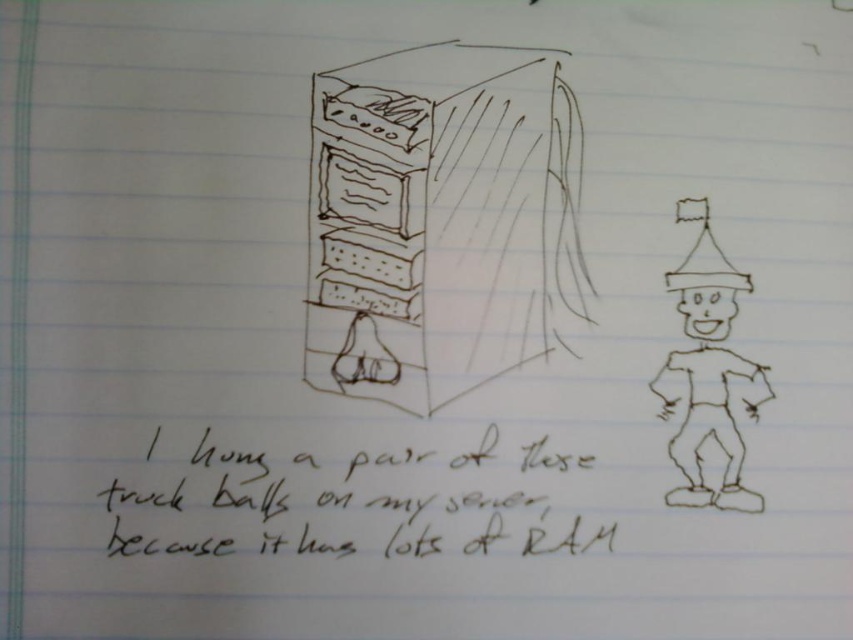
Question: Can you confirm if matte black server at center is positioned below black ink handwriting at center?

Choices:
 (A) no
 (B) yes

Answer: (A)

Question: Is black ink handwriting at center to the left of brown paper man at right from the viewer's perspective?

Choices:
 (A) no
 (B) yes

Answer: (B)

Question: Based on their relative distances, which object is farther from the brown paper man at right?

Choices:
 (A) matte black server at center
 (B) black ink handwriting at center

Answer: (B)

Question: Which object appears closest to the camera in this image?

Choices:
 (A) matte black server at center
 (B) black ink handwriting at center

Answer: (B)

Question: From the image, what is the correct spatial relationship of matte black server at center in relation to black ink handwriting at center?

Choices:
 (A) right
 (B) left

Answer: (A)

Question: Estimate the real-world distances between objects in this image. Which object is closer to the black ink handwriting at center?

Choices:
 (A) matte black server at center
 (B) brown paper man at right

Answer: (A)